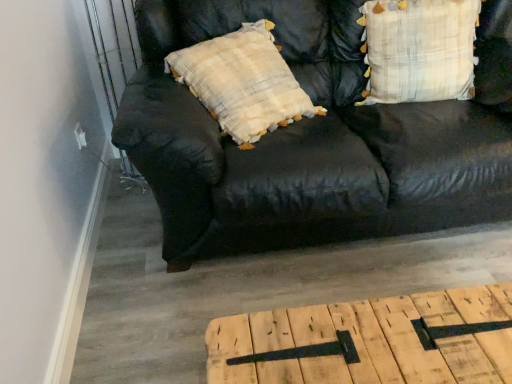
Question: Is light brown wood table at lower center outside black leather couch at center?

Choices:
 (A) yes
 (B) no

Answer: (A)

Question: Considering the relative sizes of light brown wood table at lower center and black leather couch at center in the image provided, is light brown wood table at lower center bigger than black leather couch at center?

Choices:
 (A) no
 (B) yes

Answer: (A)

Question: From the image's perspective, would you say light brown wood table at lower center is positioned over black leather couch at center?

Choices:
 (A) yes
 (B) no

Answer: (B)

Question: From a real-world perspective, does light brown wood table at lower center sit lower than black leather couch at center?

Choices:
 (A) yes
 (B) no

Answer: (A)

Question: Is light brown wood table at lower center with black leather couch at center?

Choices:
 (A) yes
 (B) no

Answer: (B)

Question: Based on their sizes in the image, would you say plaid fabric pillow at upper right is bigger or smaller than black leather couch at center?

Choices:
 (A) small
 (B) big

Answer: (A)

Question: From the image's perspective, is plaid fabric pillow at upper right above or below black leather couch at center?

Choices:
 (A) below
 (B) above

Answer: (B)

Question: In terms of width, does plaid fabric pillow at upper right look wider or thinner when compared to black leather couch at center?

Choices:
 (A) thin
 (B) wide

Answer: (A)

Question: From a real-world perspective, is plaid fabric pillow at upper right above or below black leather couch at center?

Choices:
 (A) below
 (B) above

Answer: (B)

Question: Considering the positions of black leather couch at center and light brown wood table at lower center in the image, is black leather couch at center wider or thinner than light brown wood table at lower center?

Choices:
 (A) wide
 (B) thin

Answer: (A)

Question: Is black leather couch at center in front of or behind light brown wood table at lower center in the image?

Choices:
 (A) front
 (B) behind

Answer: (B)

Question: From a real-world perspective, is black leather couch at center above or below light brown wood table at lower center?

Choices:
 (A) below
 (B) above

Answer: (B)

Question: Is point (218, 205) closer or farther from the camera than point (295, 332)?

Choices:
 (A) farther
 (B) closer

Answer: (A)

Question: Visually, is light brown wood table at lower center positioned to the left or to the right of plaid fabric pillow at upper right?

Choices:
 (A) right
 (B) left

Answer: (B)

Question: Is light brown wood table at lower center spatially inside plaid fabric pillow at upper right, or outside of it?

Choices:
 (A) inside
 (B) outside

Answer: (B)